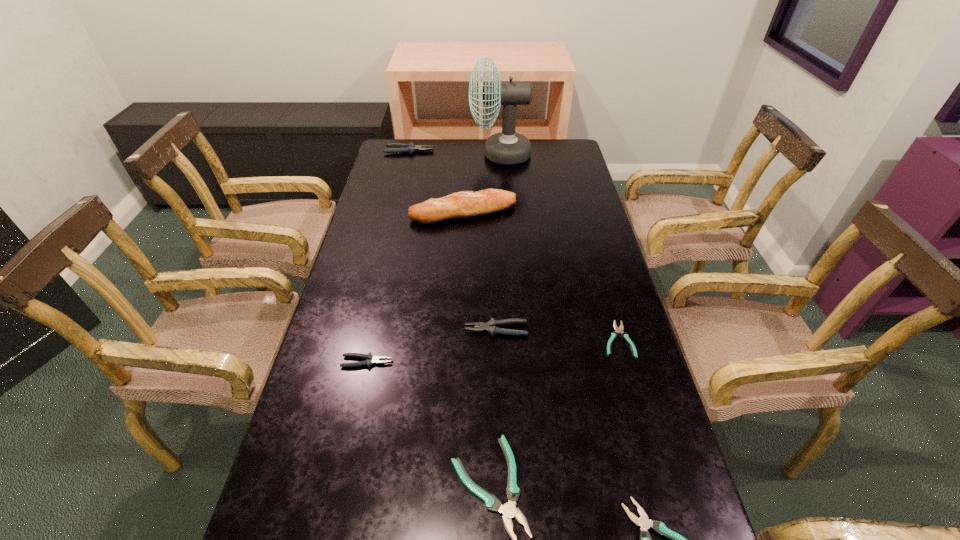
At what (x,y) coordinates should I click in order to perform the action: click on gray pliers object that ranks as the closest to the fan. Please return your answer as a coordinate pair (x, y). This screenshot has width=960, height=540. Looking at the image, I should click on (396, 147).

Identify the location of teal pliers that is the second nearest to the second tallest pliers. The width and height of the screenshot is (960, 540). (509, 511).

Locate an element on the screen. Image resolution: width=960 pixels, height=540 pixels. the closest teal pliers relative to the second smallest teal pliers is located at coordinates (509, 511).

I want to click on free location that satisfies the following two spatial constraints: 1. at the gripping part of the biggest gray pliers; 2. on the right side of the farthest teal pliers, so coord(365,339).

Image resolution: width=960 pixels, height=540 pixels. I want to click on free spot that satisfies the following two spatial constraints: 1. in front of the fan where the airflow is directed; 2. on the right side of the smallest teal pliers, so click(513, 339).